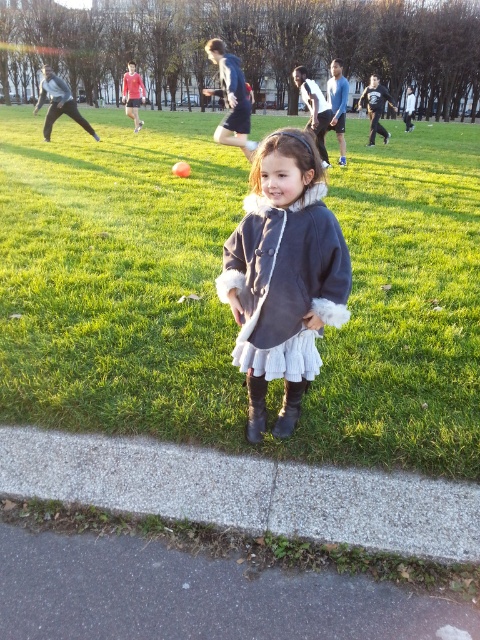
Is point (388, 188) in front of point (278, 426)?

That is False.

Is matte gray coat at center to the right of brown suede boot at lower center from the viewer's perspective?

No, matte gray coat at center is not to the right of brown suede boot at lower center.

The width and height of the screenshot is (480, 640). What are the coordinates of `matte gray coat at center` in the screenshot? It's located at (119, 278).

From the picture: Which of these two, black suede boot at lower center or brown suede boot at lower center, stands taller?

Standing taller between the two is black suede boot at lower center.

Is point (250, 417) in front of point (287, 380)?

No, it is behind (287, 380).

Between point (255, 429) and point (272, 429), which one is positioned in front?

Positioned in front is point (255, 429).

At what (x,y) coordinates should I click in order to perform the action: click on black suede boot at lower center. Please return your answer as a coordinate pair (x, y). This screenshot has width=480, height=640. Looking at the image, I should click on click(255, 408).

Is matte gray coat at center taller than velvet gray coat at center?

Correct, matte gray coat at center is much taller as velvet gray coat at center.

Is matte gray coat at center closer to camera compared to velvet gray coat at center?

No.

What do you see at coordinates (119, 278) in the screenshot? I see `matte gray coat at center` at bounding box center [119, 278].

This screenshot has width=480, height=640. Find the location of `matte gray coat at center`. matte gray coat at center is located at coordinates (119, 278).